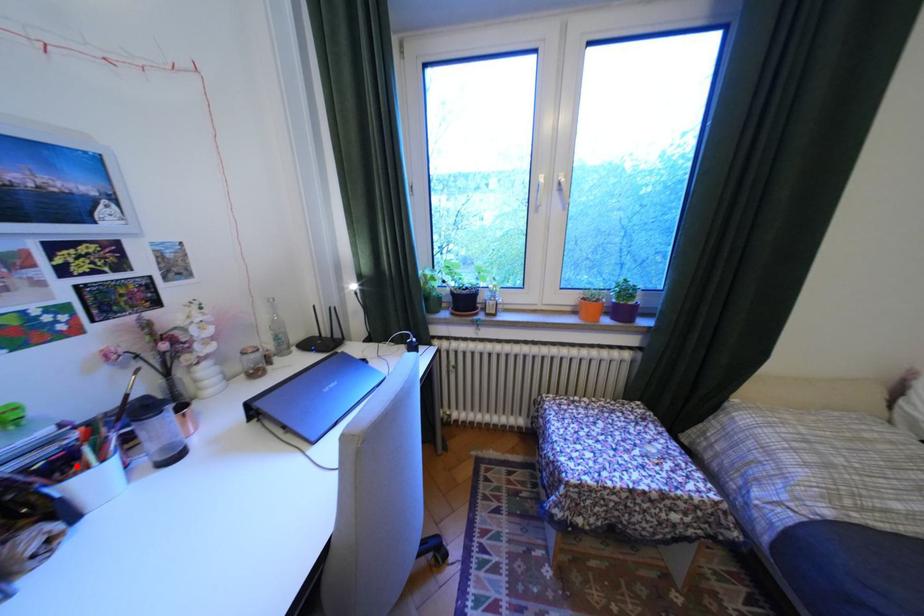
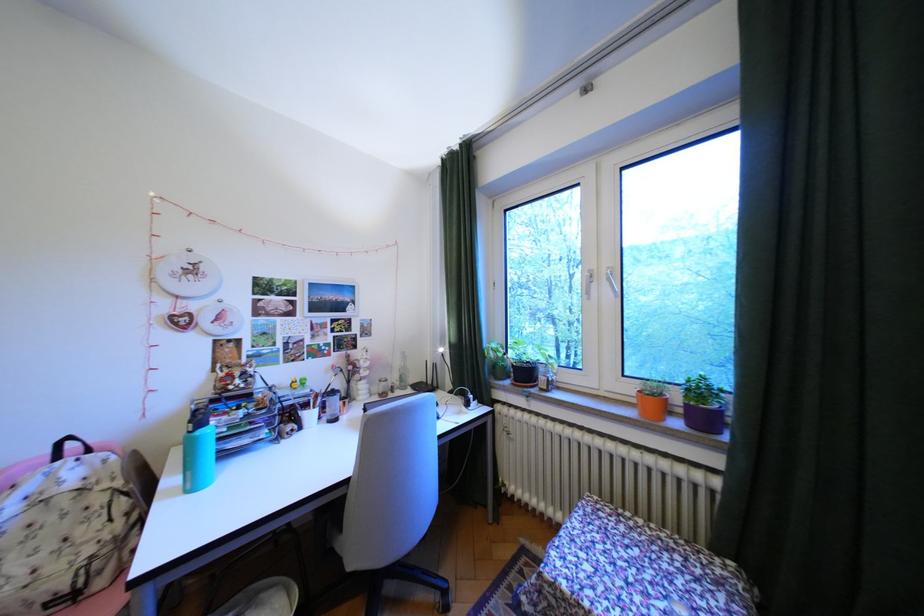
In the second image, find the point that corresponds to the highlighted location in the first image.

(318, 406)